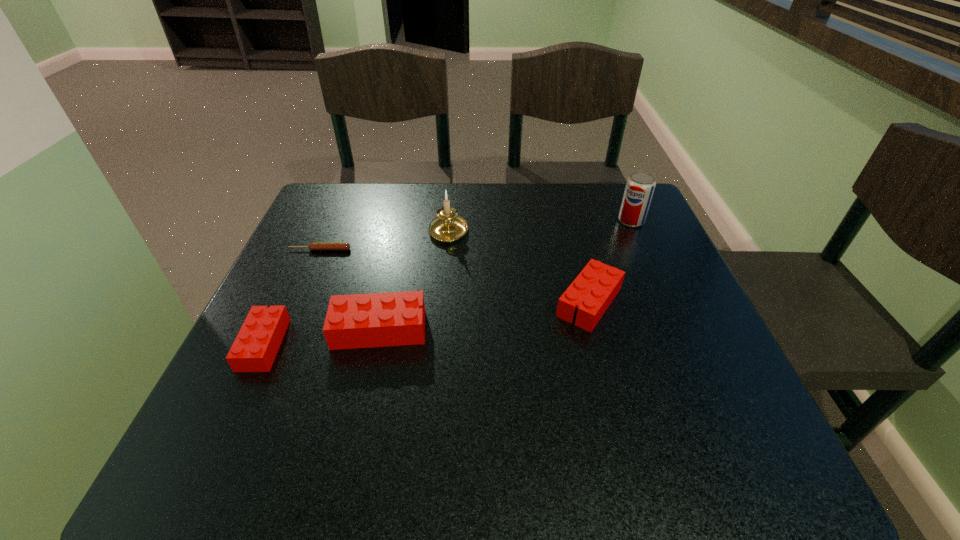
The height and width of the screenshot is (540, 960). Identify the location of the third closest object to the leftmost Lego. (448, 226).

Locate which Lego is the second closest to the candle holder. Please provide its 2D coordinates. Your answer should be formatted as a tuple, i.e. [(x, y)], where the tuple contains the x and y coordinates of a point satisfying the conditions above.

[(353, 321)]

Identify the location of Lego that is the closest one to the rightmost object. The height and width of the screenshot is (540, 960). (593, 290).

Where is `free region that satisfies the following two spatial constraints: 1. on the handle side of the soda; 2. on the right side of the candle holder`? Image resolution: width=960 pixels, height=540 pixels. free region that satisfies the following two spatial constraints: 1. on the handle side of the soda; 2. on the right side of the candle holder is located at coordinates (449, 221).